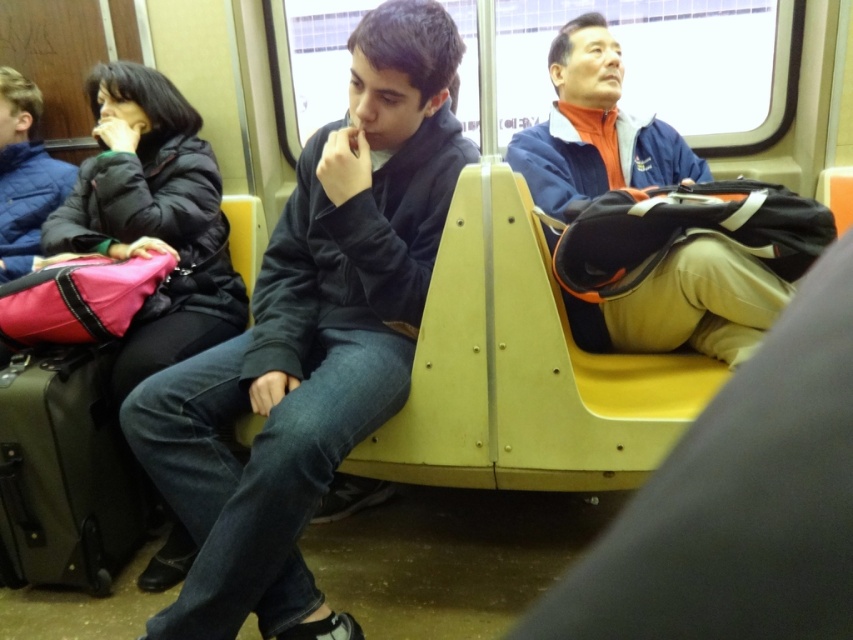
Based on the photo, you are a passenger on a subway car and need to retrieve your olive green fabric suitcase at lower left. However, there is a blue fabric jacket at right in the way. Can you remove the jacket to access your suitcase?

The blue fabric jacket at right is positioned over olive green fabric suitcase at lower left, so you can remove the jacket to access your suitcase.

Consider the image. You are a delivery robot carrying a package that measures 24 inches in length. You need to place it between the dark blue hoodie at center and the blue fabric jacket at right. Is there enough space for the package?

The distance between the dark blue hoodie at center and the blue fabric jacket at right is 24.31 inches. Since the package is 24 inches long, there is enough space to place it between them.

You are a passenger in the subway car and want to place a small backpack on the bench seat. The backpack requires a space of at least 0.4 meters in width. Given the coordinates of the dark blue hoodie at center, can you determine if there is enough space next to it for the backpack?

The dark blue hoodie at center is located at coordinates point (310, 339). Since the required space for the backpack is 0.4 meters in width, and the hoodie is positioned at this coordinate, there is insufficient space next to it to accommodate the backpack.